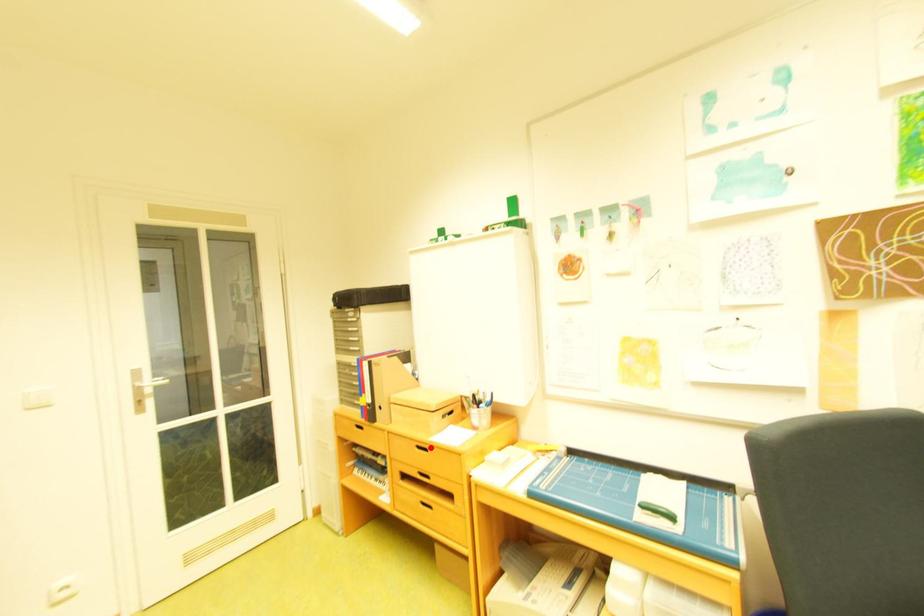
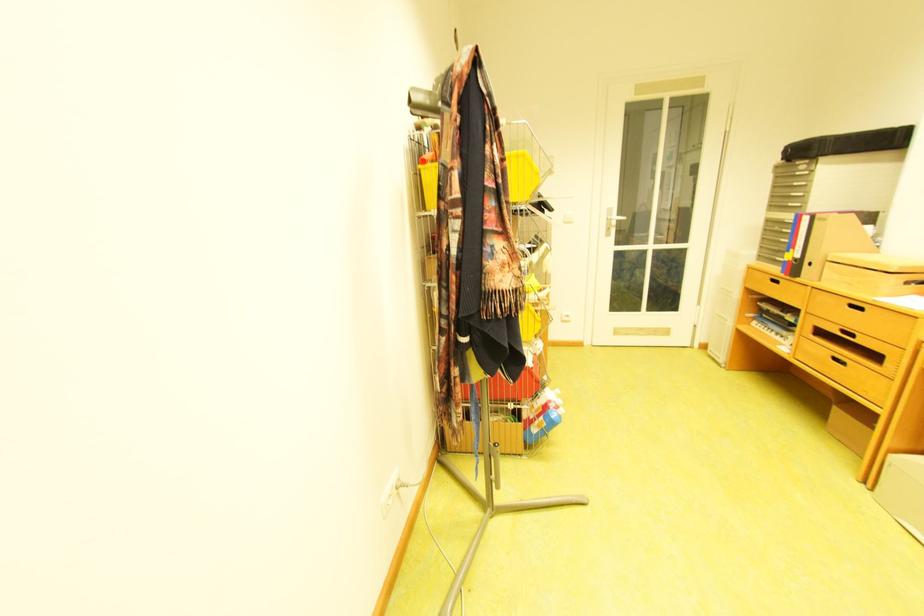
Question: I am providing you with two images of the same scene from different viewpoints. Image1 has a red point marked. In image2, the corresponding 3D location appears at what relative position? Reply with the corresponding letter.

Choices:
 (A) Closer
 (B) Farther

Answer: (A)